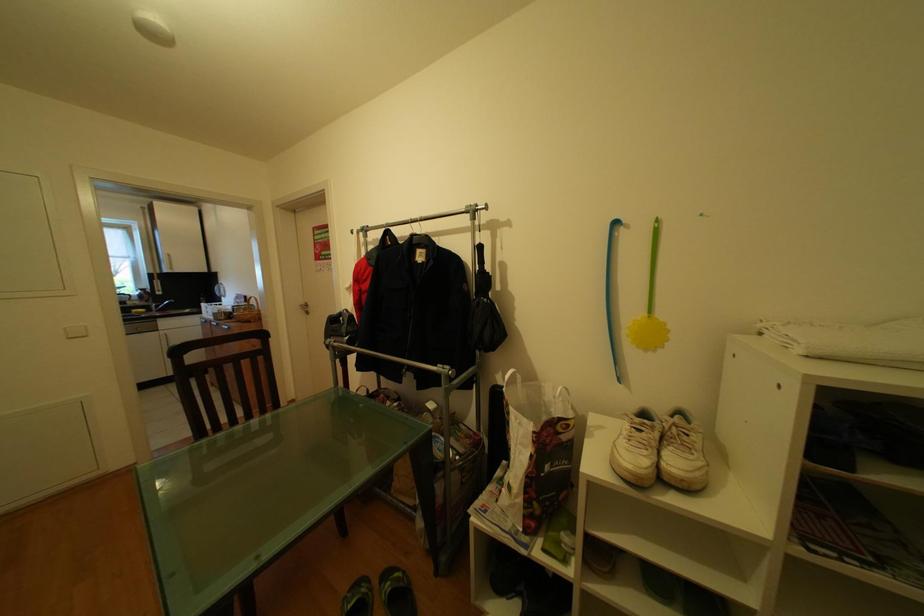
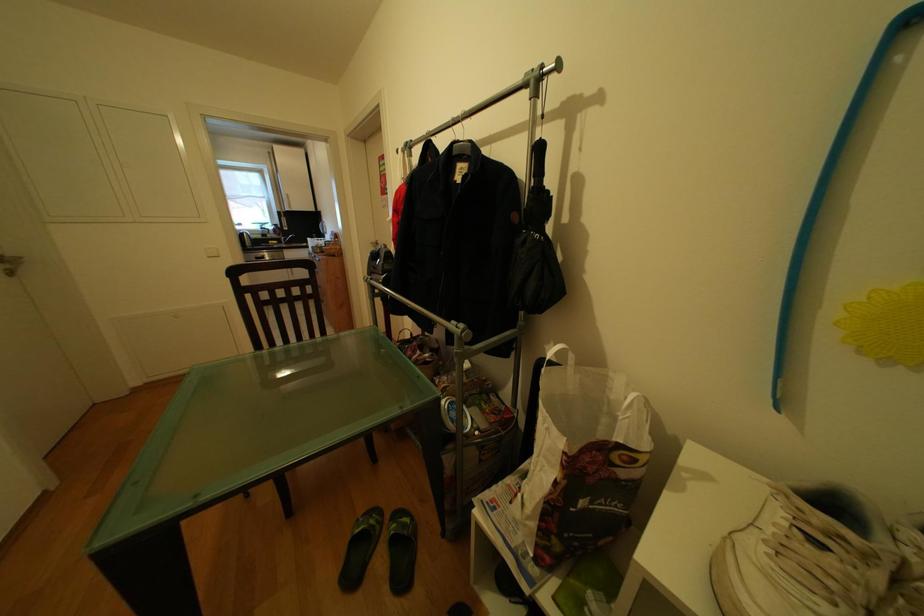
Question: The camera is either moving clockwise (left) or counter-clockwise (right) around the object. The first image is from the beginning of the video and the second image is from the end. Is the camera moving left or right when shooting the video?

Choices:
 (A) Left
 (B) Right

Answer: (B)